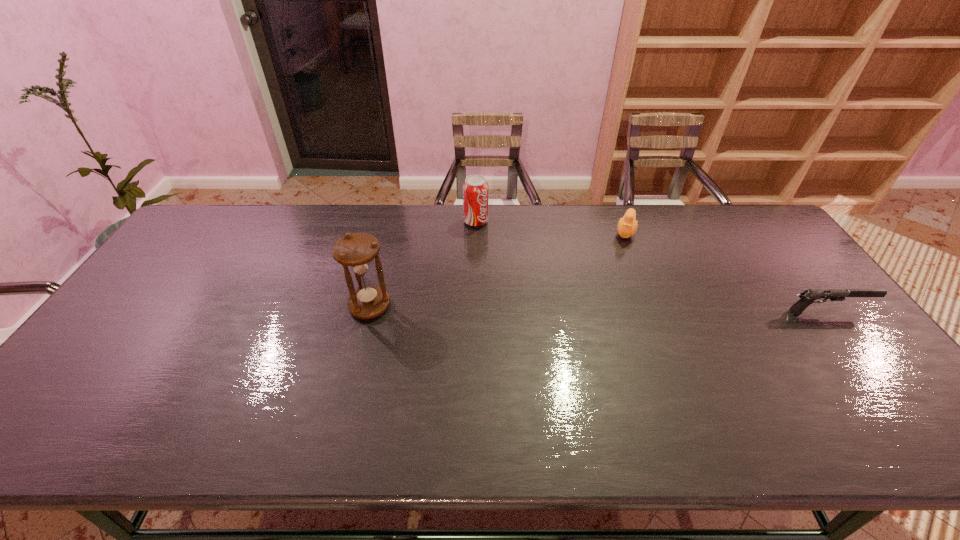
Image resolution: width=960 pixels, height=540 pixels. I want to click on vacant space on the desktop that is between the hourglass and the rightmost object and is positioned on the logo side of the second tallest object, so click(582, 309).

Identify the location of vacant spot on the desktop that is between the tallest object and the rightmost object and is positioned on the face of the third object from left to right. (602, 309).